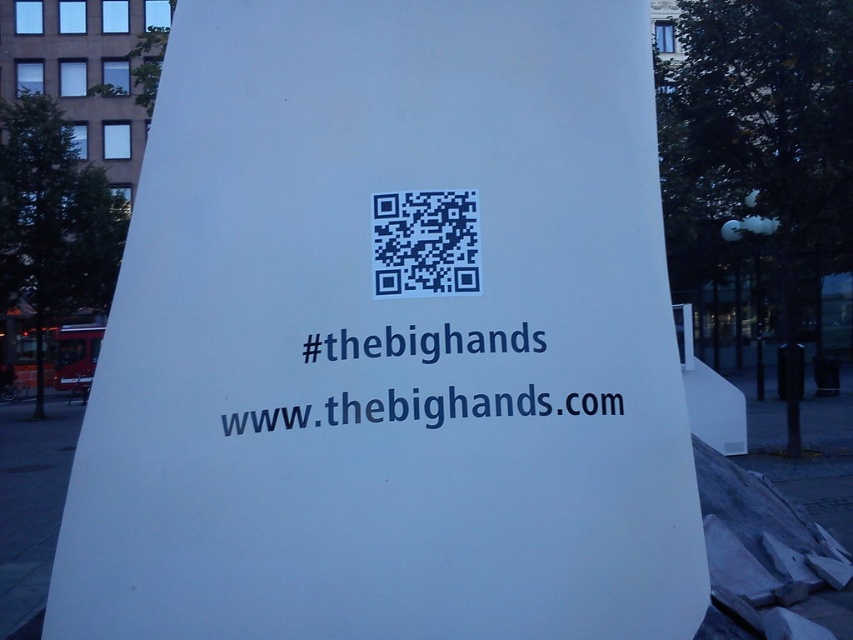
Question: Is blue text at center above dark blue qr code at center?

Choices:
 (A) yes
 (B) no

Answer: (B)

Question: Which point is farther to the camera?

Choices:
 (A) (469, 337)
 (B) (437, 236)

Answer: (B)

Question: Can you confirm if blue text at center is wider than dark blue qr code at center?

Choices:
 (A) no
 (B) yes

Answer: (B)

Question: Which of the following is the farthest from the observer?

Choices:
 (A) (422, 189)
 (B) (495, 340)

Answer: (A)

Question: Does blue text at center appear on the right side of dark blue qr code at center?

Choices:
 (A) no
 (B) yes

Answer: (B)